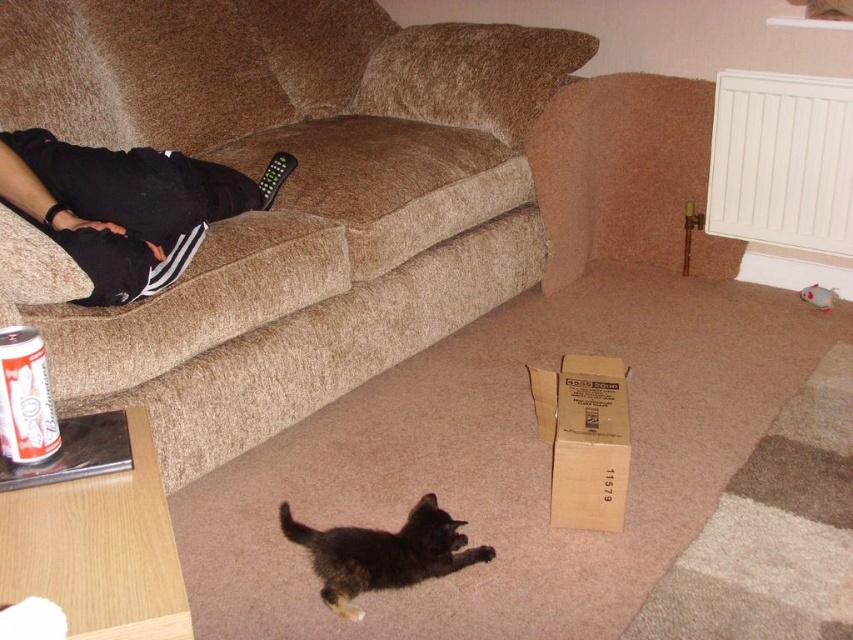
Question: Is black cotton shirt at upper left closer to the viewer compared to brown cardboard box at lower center?

Choices:
 (A) no
 (B) yes

Answer: (B)

Question: Which object appears farthest from the camera in this image?

Choices:
 (A) beige fabric couch at upper center
 (B) dark brown fur kitten at center
 (C) black plastic remote at center

Answer: (C)

Question: Which object appears closest to the camera in this image?

Choices:
 (A) black plastic remote at center
 (B) beige fabric couch at upper center

Answer: (B)

Question: Which object is farther from the camera taking this photo?

Choices:
 (A) black cotton shirt at upper left
 (B) brown cardboard box at lower center
 (C) beige fabric couch at upper center

Answer: (B)

Question: In this image, where is beige fabric couch at upper center located relative to brown cardboard box at lower center?

Choices:
 (A) right
 (B) left

Answer: (B)

Question: Can you confirm if beige fabric couch at upper center is wider than black cotton shirt at upper left?

Choices:
 (A) no
 (B) yes

Answer: (B)